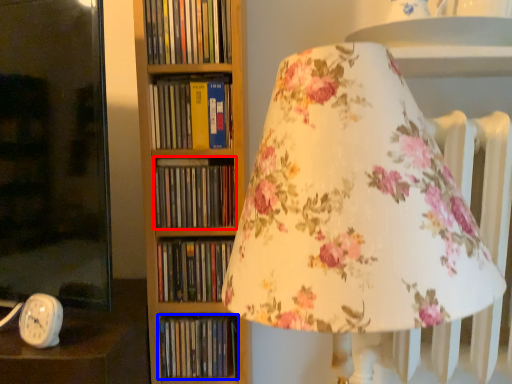
Question: Which object appears farthest to the camera in this image, book (highlighted by a red box) or book (highlighted by a blue box)?

Choices:
 (A) book
 (B) book

Answer: (B)